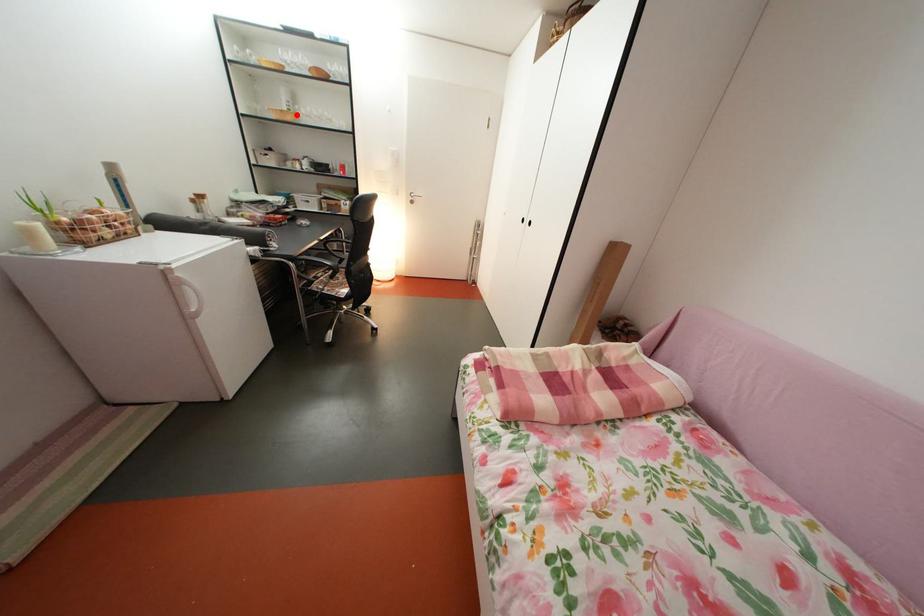
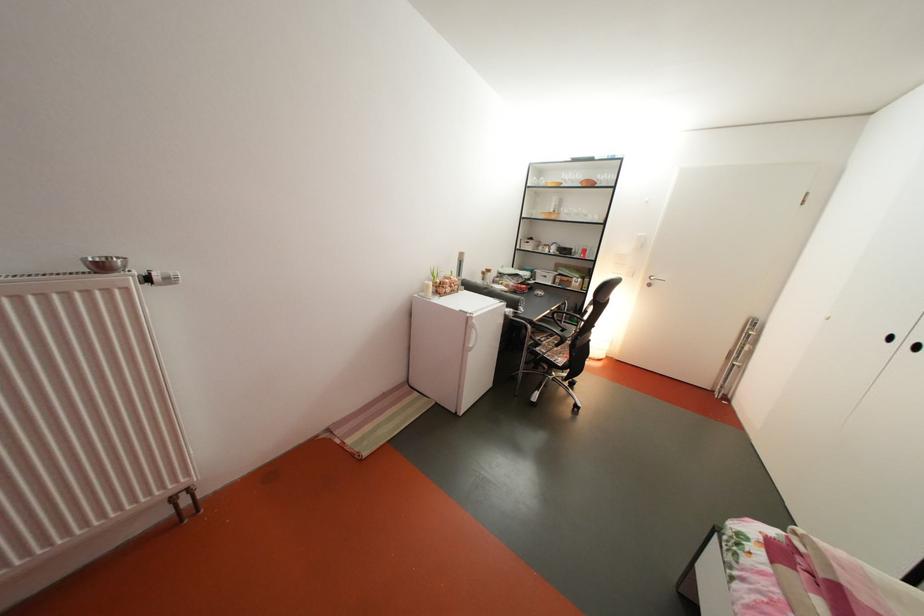
Where in the second image is the point corresponding to the highlighted location from the first image?

(563, 217)